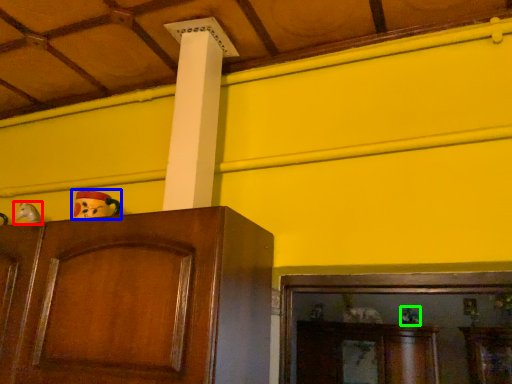
Question: Estimate the real-world distances between objects in this image. Which object is farther from toy (highlighted by a red box), toy (highlighted by a blue box) or toy (highlighted by a green box)?

Choices:
 (A) toy
 (B) toy

Answer: (B)